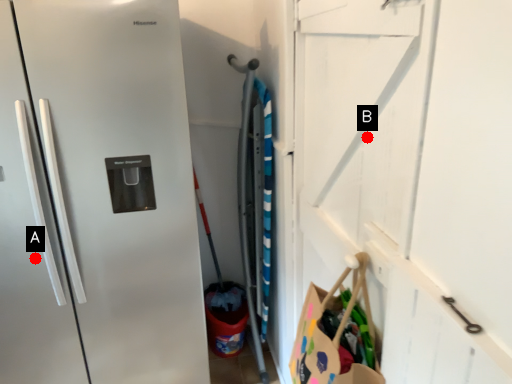
Question: Two points are circled on the image, labeled by A and B beside each circle. Which point appears closest to the camera in this image?

Choices:
 (A) A is closer
 (B) B is closer

Answer: (B)